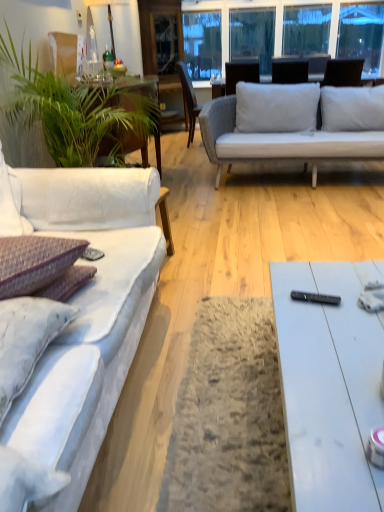
Find the location of a particular element. This screenshot has height=512, width=384. vacant region to the left of black plastic remote control at center is located at coordinates (285, 306).